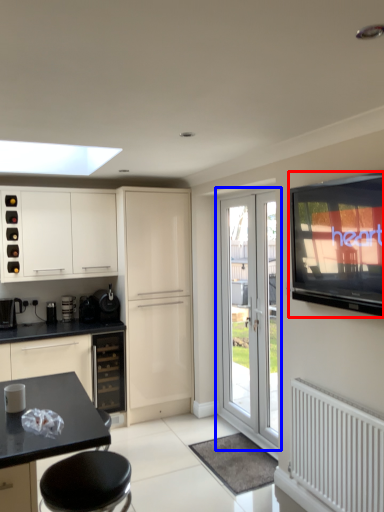
Question: Which object is closer to the camera taking this photo, television (highlighted by a red box) or door (highlighted by a blue box)?

Choices:
 (A) television
 (B) door

Answer: (A)